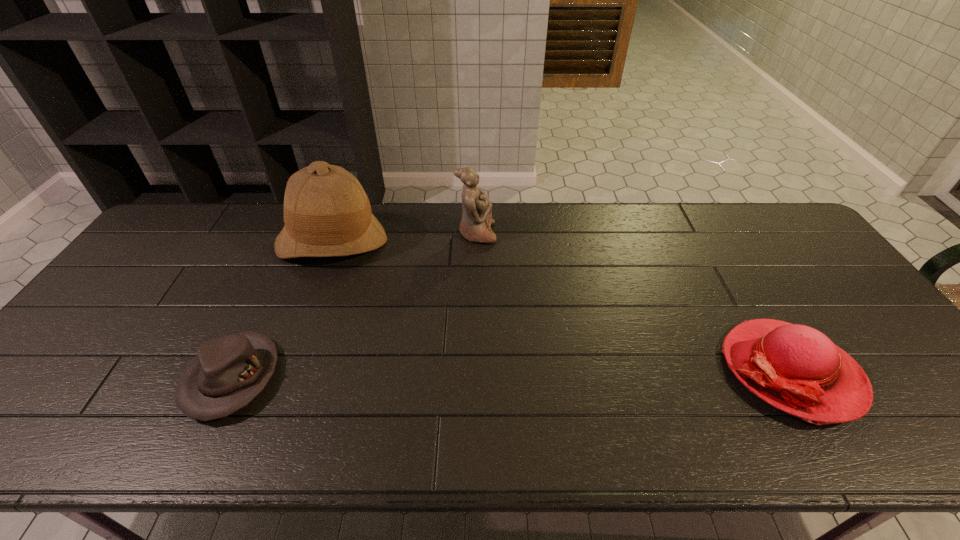
What are the coordinates of `the farthest hat` in the screenshot? It's located at (327, 213).

Where is `the third object from left to right`? the third object from left to right is located at coordinates (475, 226).

You are a GUI agent. You are given a task and a screenshot of the screen. Output one action in this format:
    pyautogui.click(x=<x>, y=<y>)
    Task: Click on the third shortest object
    The image size is (960, 540).
    Given the screenshot: What is the action you would take?
    pyautogui.click(x=475, y=226)

Where is `the rightmost hat`? The height and width of the screenshot is (540, 960). the rightmost hat is located at coordinates (797, 369).

The image size is (960, 540). Find the location of `the rightmost object`. the rightmost object is located at coordinates (797, 369).

This screenshot has height=540, width=960. Identify the location of the shortest object. (229, 371).

Locate an element on the screen. vacant space located on the front-facing side of the farthest hat is located at coordinates (314, 290).

Locate an element on the screen. vacant space located on the front-facing side of the second tallest object is located at coordinates (527, 233).

Where is `free space located at the front of the rightmost object with a bow`? free space located at the front of the rightmost object with a bow is located at coordinates (655, 371).

The image size is (960, 540). I want to click on free location located 0.070m at the front of the rightmost object with a bow, so click(696, 371).